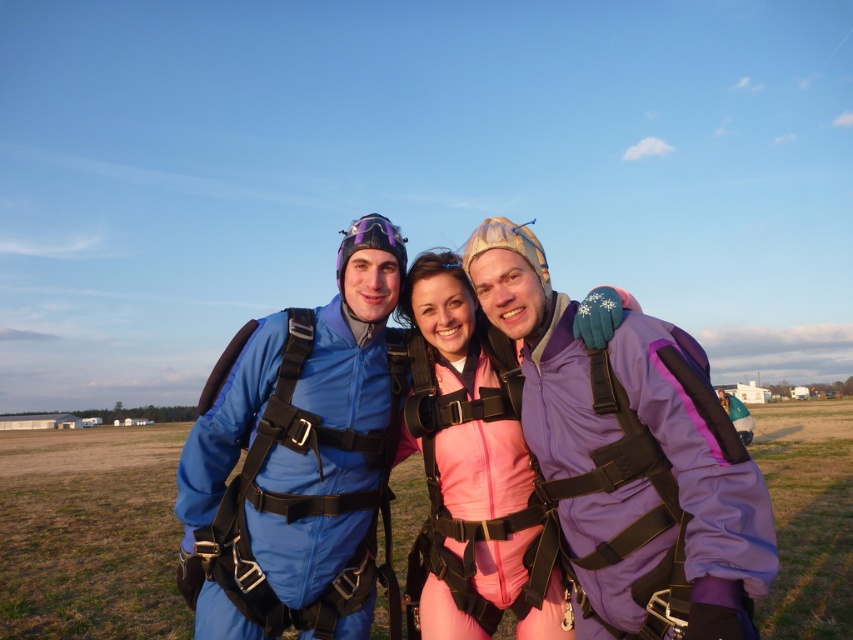
You are a photographer planning to capture a group photo of the matte blue jumpsuit at center and the pink fabric jumpsuit at center. To ensure both suits are clearly visible, you need to adjust the camera focus based on their sizes. Which suit should you focus on first to accommodate its larger size?

The matte blue jumpsuit at center has a larger width than the pink fabric jumpsuit at center, so you should focus on the matte blue jumpsuit at center first to ensure its larger size is properly captured.

Looking at this image, you are a drone operator planning to capture a closeup shot of the point at coordinates (554, 378). Given that your drone can only fly up to 3 meters away from its starting position, will you be able to reach that point?

The distance between the point at coordinates (554, 378) and the viewer is 3.11 meters. Since the drone can only fly up to 3 meters, it cannot reach the point as the required distance exceeds its maximum range.